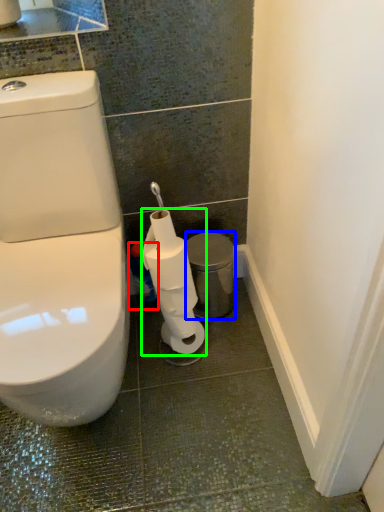
Question: Which object is positioned farthest from cleaning product (highlighted by a red box)? Select from porcelain (highlighted by a blue box) and toilet paper (highlighted by a green box).

Choices:
 (A) porcelain
 (B) toilet paper

Answer: (B)